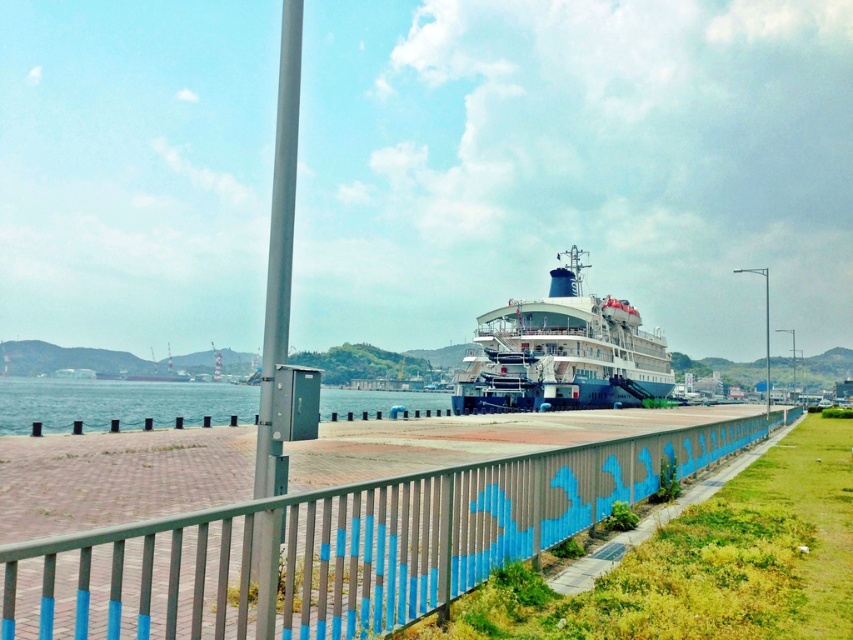
What do you see at coordinates (337, 545) in the screenshot? This screenshot has height=640, width=853. I see `metallic blue fence at center` at bounding box center [337, 545].

Image resolution: width=853 pixels, height=640 pixels. What do you see at coordinates (337, 545) in the screenshot? I see `metallic blue fence at center` at bounding box center [337, 545].

Locate an element on the screen. Image resolution: width=853 pixels, height=640 pixels. metallic blue fence at center is located at coordinates (337, 545).

Consider the image. Is metallic blue fence at center below clear water at lower left?

No, metallic blue fence at center is not below clear water at lower left.

I want to click on metallic blue fence at center, so click(x=337, y=545).

Who is more forward, (630, 396) or (105, 413)?

Point (105, 413) is in front.

Is white glossy cruise ship at center closer to the viewer compared to clear water at lower left?

No.

Identify the location of white glossy cruise ship at center. Image resolution: width=853 pixels, height=640 pixels. (561, 353).